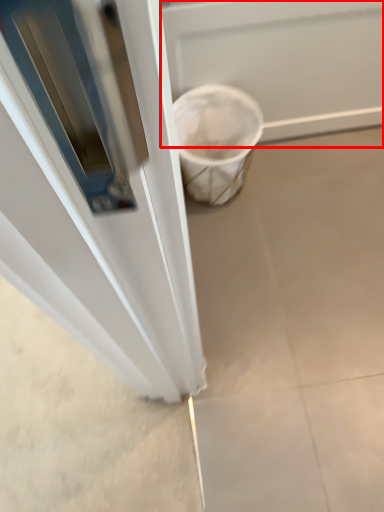
Question: From the image's perspective, considering the relative positions of screen door (annotated by the red box) and concrete in the image provided, where is screen door (annotated by the red box) located with respect to the staircase?

Choices:
 (A) below
 (B) above

Answer: (B)